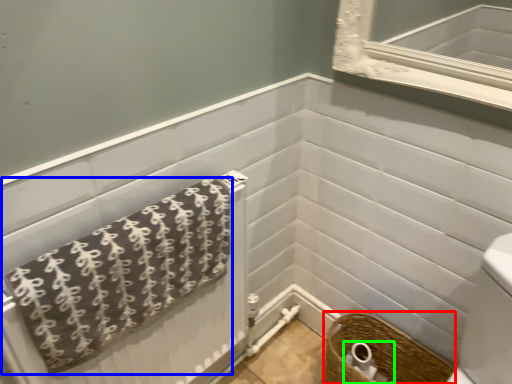
Question: Based on their relative distances, which object is nearer to basket (highlighted by a red box)? Choose from towel (highlighted by a blue box) and toilet paper (highlighted by a green box).

Choices:
 (A) towel
 (B) toilet paper

Answer: (B)